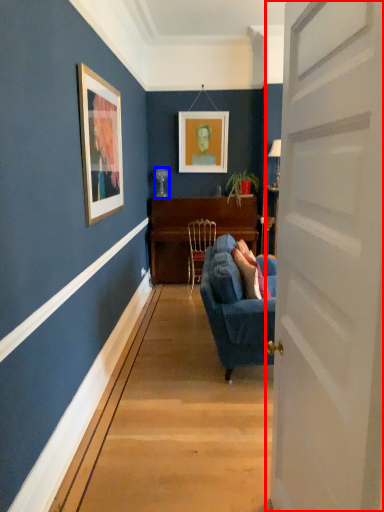
Question: Which point is further to the camera, door (highlighted by a red box) or lamp (highlighted by a blue box)?

Choices:
 (A) door
 (B) lamp

Answer: (B)